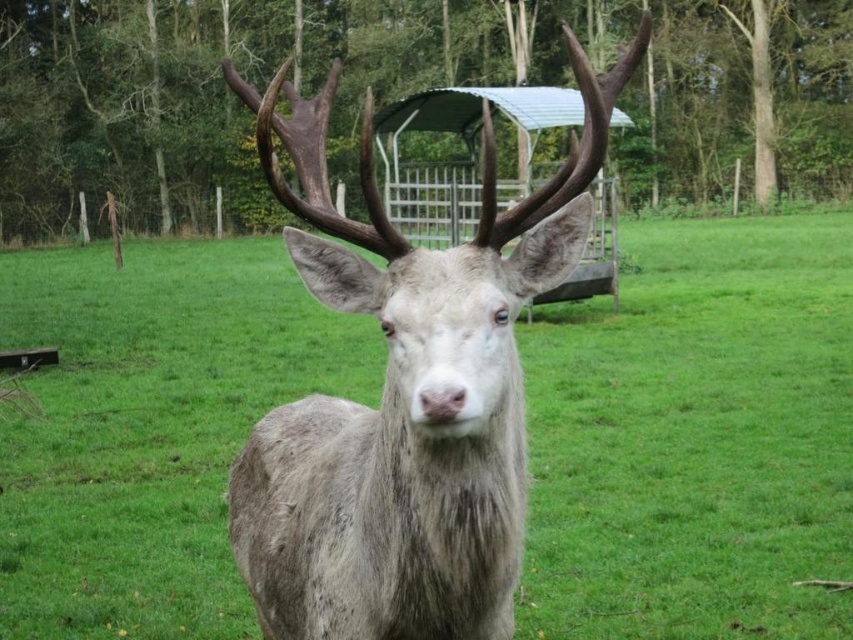
Question: Which of the following is the farthest from the observer?

Choices:
 (A) (409, 451)
 (B) (47, 620)

Answer: (B)

Question: Is green grassy at center below fuzzy gray deer at center?

Choices:
 (A) yes
 (B) no

Answer: (A)

Question: Does green grassy at center appear over fuzzy gray deer at center?

Choices:
 (A) no
 (B) yes

Answer: (A)

Question: Is green grassy at center positioned at the back of fuzzy gray deer at center?

Choices:
 (A) yes
 (B) no

Answer: (A)

Question: Among these objects, which one is nearest to the camera?

Choices:
 (A) fuzzy gray deer at center
 (B) green grassy at center

Answer: (A)